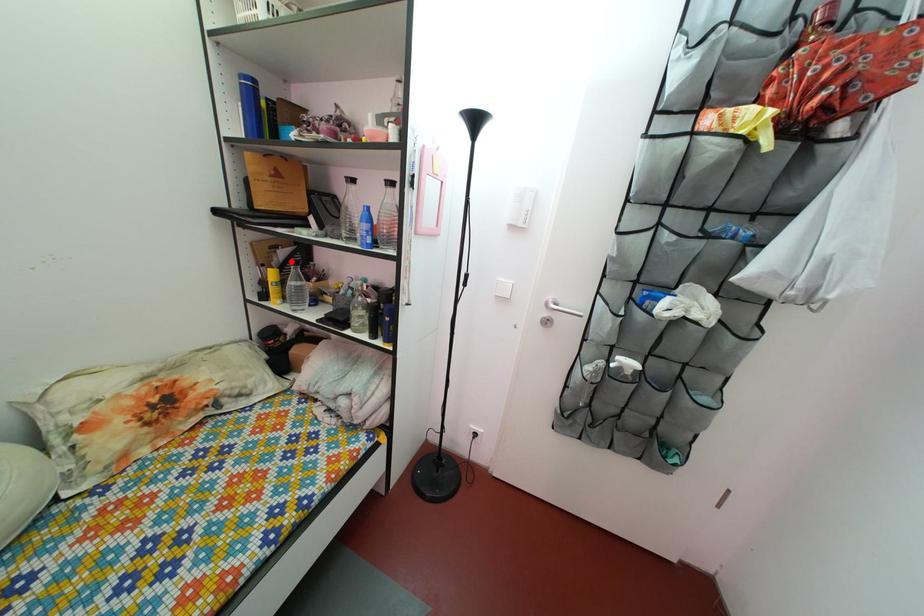
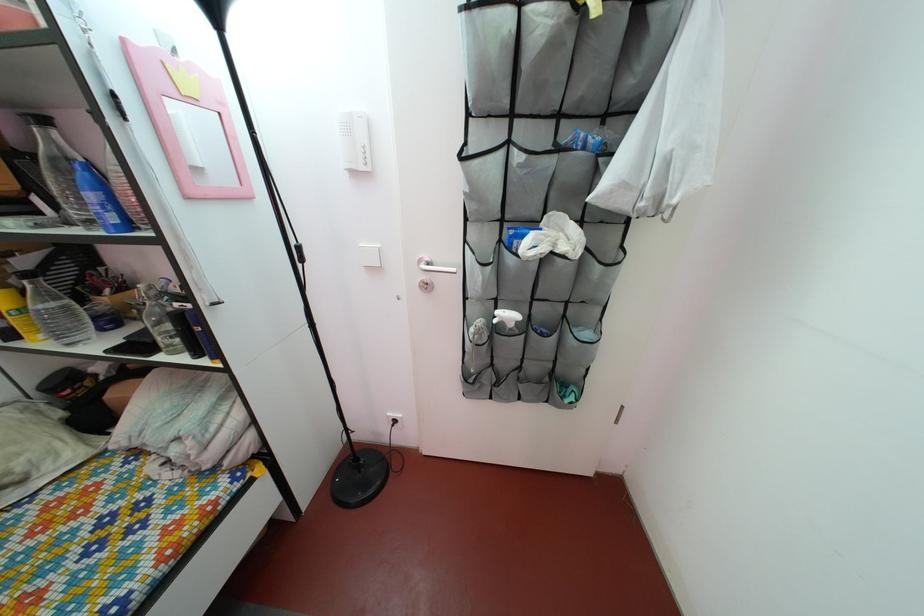
Find the pixel in the second image that matches the highlighted location in the first image.

(32, 270)